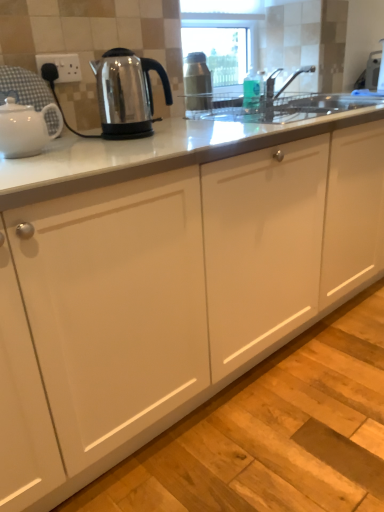
At what (x,y) coordinates should I click in order to perform the action: click on vacant area located to the right-hand side of stainless steel kettle at left, the second kettle viewed from the left. Please return your answer as a coordinate pair (x, y). Looking at the image, I should click on (187, 132).